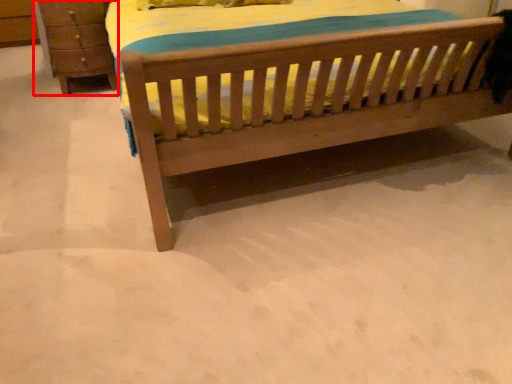
Question: From the image, what is the correct spatial relationship of chest of drawers (annotated by the red box) in relation to bed?

Choices:
 (A) right
 (B) left

Answer: (B)